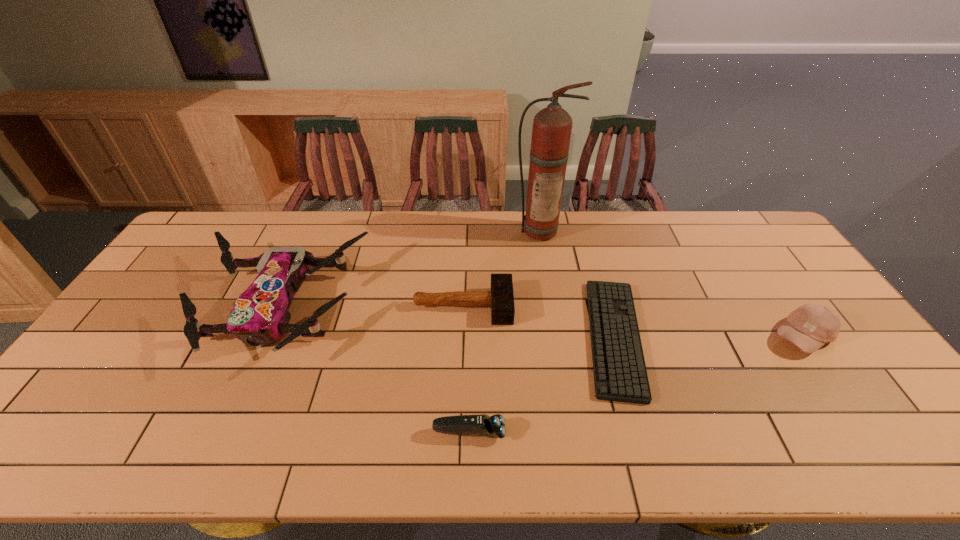
The width and height of the screenshot is (960, 540). In order to click on the second closest object to the computer keyboard in this screenshot , I will do `click(552, 126)`.

Where is `object that is the nearest to the computer keyboard`? object that is the nearest to the computer keyboard is located at coordinates (501, 297).

You are a GUI agent. You are given a task and a screenshot of the screen. Output one action in this format:
    pyautogui.click(x=<x>, y=<y>)
    Task: Click on the vacant position in the image that satisfies the following two spatial constraints: 1. on the front side of the computer keyboard; 2. on the head of the electric shaver
    The image size is (960, 540).
    Given the screenshot: What is the action you would take?
    pyautogui.click(x=641, y=432)

This screenshot has height=540, width=960. Find the location of `vacant space that satisfies the following two spatial constraints: 1. on the front-facing side of the baseball cap; 2. on the head of the electric shaver`. vacant space that satisfies the following two spatial constraints: 1. on the front-facing side of the baseball cap; 2. on the head of the electric shaver is located at coordinates (868, 432).

Identify the location of free spot that satisfies the following two spatial constraints: 1. on the side of the farthest object with the label and nozzle; 2. on the hammer head face of the mallet. The image size is (960, 540). (552, 306).

Locate an element on the screen. free location that satisfies the following two spatial constraints: 1. on the hammer head face of the mallet; 2. on the right side of the shortest object is located at coordinates point(462,337).

You are a GUI agent. You are given a task and a screenshot of the screen. Output one action in this format:
    pyautogui.click(x=<x>, y=<y>)
    Task: Click on the vacant space that satisfies the following two spatial constraints: 1. on the front-facing side of the leftmost object; 2. on the right side of the shortest object
    Image resolution: width=960 pixels, height=540 pixels.
    Given the screenshot: What is the action you would take?
    pyautogui.click(x=265, y=337)

You are a GUI agent. You are given a task and a screenshot of the screen. Output one action in this format:
    pyautogui.click(x=<x>, y=<y>)
    Task: Click on the vacant region that satisfies the following two spatial constraints: 1. on the side of the farthest object with the label and nozzle; 2. on the head of the electric shaver
    This screenshot has width=960, height=540.
    Given the screenshot: What is the action you would take?
    pyautogui.click(x=573, y=432)